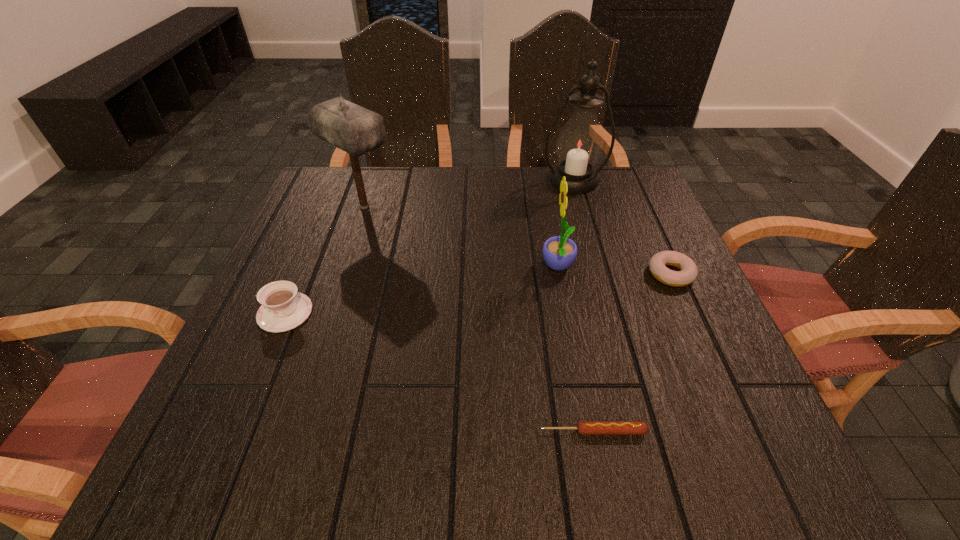
The height and width of the screenshot is (540, 960). In order to click on free point that satisfies the following two spatial constraints: 1. on the front side of the mallet; 2. on the handle side of the fourth tallest object in this screenshot , I will do `click(330, 313)`.

You are a GUI agent. You are given a task and a screenshot of the screen. Output one action in this format:
    pyautogui.click(x=<x>, y=<y>)
    Task: Click on the vacant space that satisfies the following two spatial constraints: 1. on the front-facing side of the third tallest object; 2. on the back side of the shortest object
    This screenshot has height=540, width=960.
    Given the screenshot: What is the action you would take?
    pyautogui.click(x=588, y=431)

Identify the location of free space that satisfies the following two spatial constraints: 1. on the front-facing side of the fourth shortest object; 2. on the right side of the shortest object. Image resolution: width=960 pixels, height=540 pixels. (588, 431).